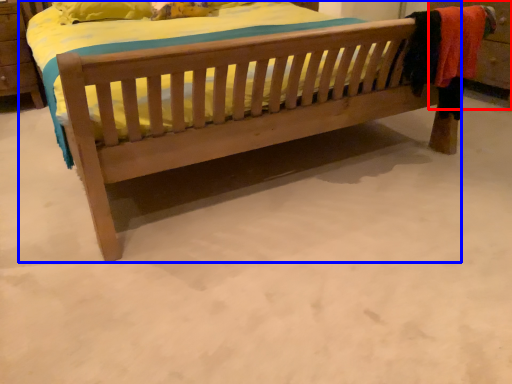
Question: Among these objects, which one is nearest to the camera, dresser (highlighted by a red box) or bed (highlighted by a blue box)?

Choices:
 (A) dresser
 (B) bed

Answer: (B)